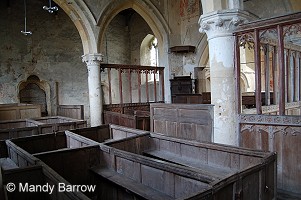
Identify the location of overhead ornaments. (25, 31), (53, 7).